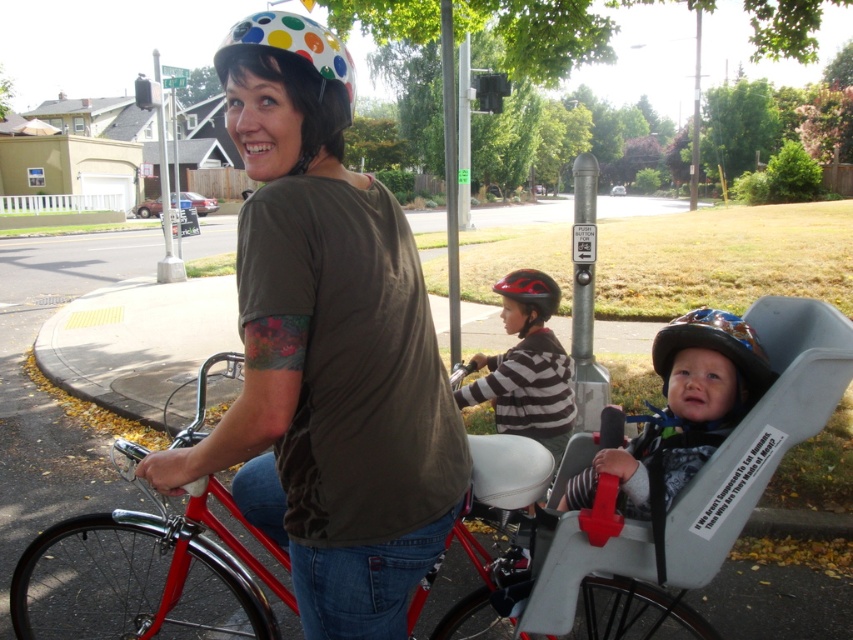
You are a photographer standing at the camera position. You want to take a closeup photo of the matte black helmet at center. Can you reach it with your hand without moving from your current position?

The matte black helmet at center is 1.98 meters away from camera, so you cannot reach it with your hand without moving from your current position.

You are planning to install a new streetlight on the suburban street. The current pole is the brushed metal pole at center. You have a new streetlight that is wider than the existing pole. Will the white polka dot helmet at upper center fit between the new streetlight and the existing pole without overlapping?

The white polka dot helmet at upper center is wider than the brushed metal pole at center. Since the new streetlight is wider than the existing pole, there might not be enough space between them to fit the helmet without overlapping. However, the question is about installing a streetlight, not placing the helmet. The spatial relationship between the helmet and the poles isn

Consider the image. You are a pedestrian standing at the crosswalk. You see the white polka dot helmet at upper center and the brushed metal pole at center. Which object is closer to the ground?

The white polka dot helmet at upper center is located below the brushed metal pole at center, so it is closer to the ground.